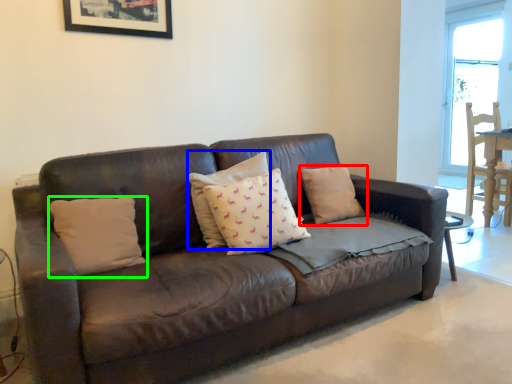
Question: Which object is positioned closest to pillow (highlighted by a red box)? Select from pillow (highlighted by a blue box) and pillow (highlighted by a green box).

Choices:
 (A) pillow
 (B) pillow

Answer: (A)